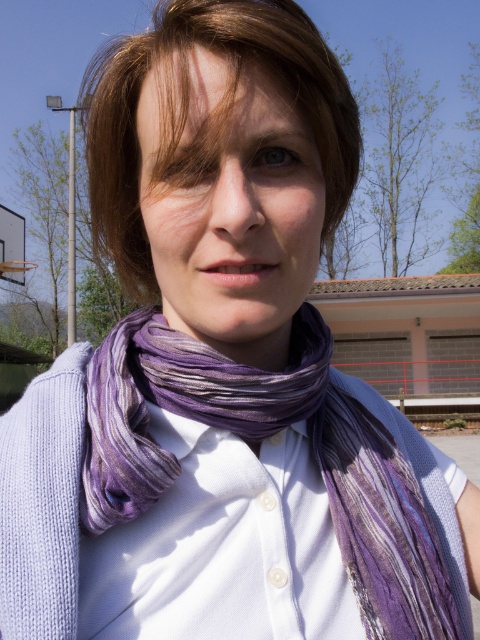
You are standing in front of a person wearing a purple striped scarf at center and has brownsmoothhair at center. Which object is closer to you?

The brownsmoothhair at center is closer to the viewer than the purple striped scarf at center.

You are trying to decide which scarf to wear today. You see both the purple silk scarf at center and the purple striped scarf at center in the image. According to the image, which one is wider?

The purple silk scarf at center might be wider than purple striped scarf at center.

You are a photographer trying to capture a portrait of the person in the scene. You want to ensure that both the brownsmoothhair at center and the purple striped scarf at center are clearly visible in the frame. Given their sizes, which object should you focus on to ensure both are in focus?

The brownsmoothhair at center is taller than the purple striped scarf at center. To ensure both are in focus, you should focus on the brownsmoothhair at center since it is larger and requires more attention to detail.